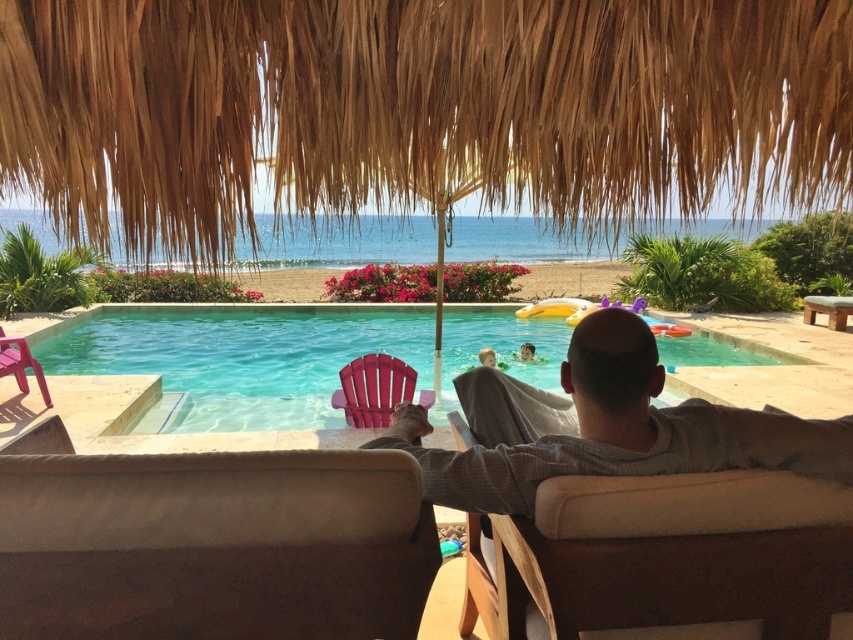
In the scene shown: You are standing at the position of the man in the scene. You want to walk to the point marked as point (350, 413). Which direction should you move relative to the other point, point (115, 358)?

Point (115, 358) is behind point (350, 413). To reach point (350, 413), you should move forward away from point (115, 358).

You are planning to place a new rectangular table between the clear blue water at center and the plastic beach chair at lower left. Considering their sizes, which object should the table be placed closer to to ensure it fits better?

The clear blue water at center has a larger width than the plastic beach chair at lower left, so the table should be placed closer to the plastic beach chair at lower left to ensure it fits better.

You are standing at the entrance of the pool area and want to sit down. There is a clear blue water at center and a plastic beach chair at lower left. Which one is closer to your right side?

The clear blue water at center is to the right of plastic beach chair at lower left, so the clear blue water at center is closer to your right side.